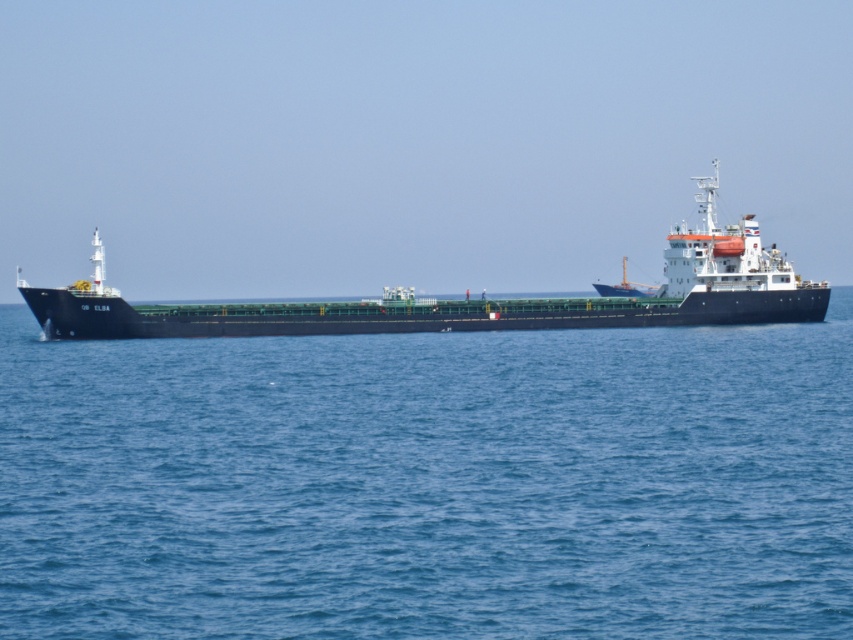
In the scene shown: Is blue water at center to the left of green matte ship at center from the viewer's perspective?

Incorrect, blue water at center is not on the left side of green matte ship at center.

The width and height of the screenshot is (853, 640). In order to click on blue water at center in this screenshot , I will do `click(428, 483)`.

Where is `blue water at center`? The height and width of the screenshot is (640, 853). blue water at center is located at coordinates (428, 483).